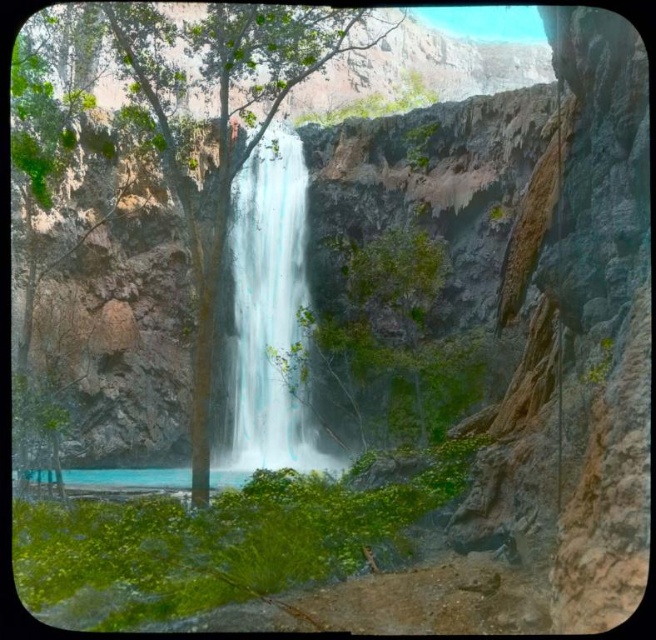
You are a hiker standing at the edge of the waterfall and you see the green leafy tree at center and the turquoise glossy water at center. Which object is bigger in size?

The green leafy tree at center has a larger size compared to the turquoise glossy water at center, so the green leafy tree at center is bigger in size.

You are a photographer planning to capture the white smooth waterfall at center and the turquoise glossy water at center in a single shot. Based on their positions, which one should you focus on first to ensure both are in sharp focus?

The turquoise glossy water at center is behind the white smooth waterfall at center, so you should focus on the white smooth waterfall at center first to ensure both are in sharp focus.

You are a photographer planning to capture the white smooth waterfall at center and the turquoise glossy water at center in a single shot. Based on their positions, which one should you focus on first to ensure both are in the frame?

The white smooth waterfall at center is positioned on the right side of the turquoise glossy water at center, so you should focus on the turquoise glossy water at center first to ensure both are in the frame.